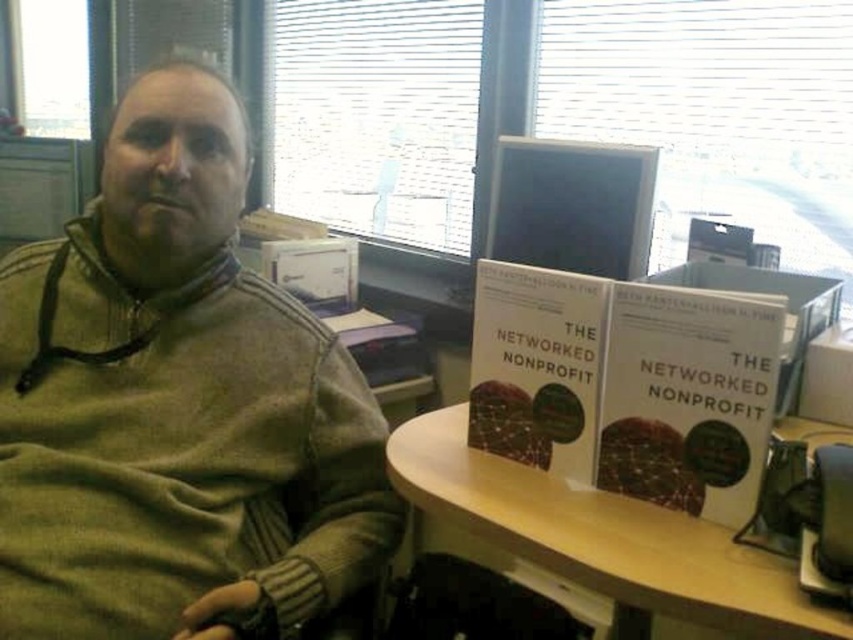
Question: Among these objects, which one is farthest from the camera?

Choices:
 (A) white matte book at center
 (B) light brown wood table at center
 (C) green knitwear at center

Answer: (A)

Question: Is green knitwear at center further to camera compared to light brown wood table at center?

Choices:
 (A) yes
 (B) no

Answer: (A)

Question: Estimate the real-world distances between objects in this image. Which object is farther from the matte plastic computer monitor at upper center?

Choices:
 (A) light brown wood table at center
 (B) green knitwear at center
 (C) white matte book at center

Answer: (B)

Question: Does white matte book at center have a larger size compared to matte plastic computer monitor at upper center?

Choices:
 (A) no
 (B) yes

Answer: (A)

Question: Can you confirm if light brown wood table at center is thinner than matte plastic computer monitor at upper center?

Choices:
 (A) no
 (B) yes

Answer: (A)

Question: Estimate the real-world distances between objects in this image. Which object is farther from the green knitwear at center?

Choices:
 (A) matte plastic computer monitor at upper center
 (B) white matte book at center

Answer: (A)